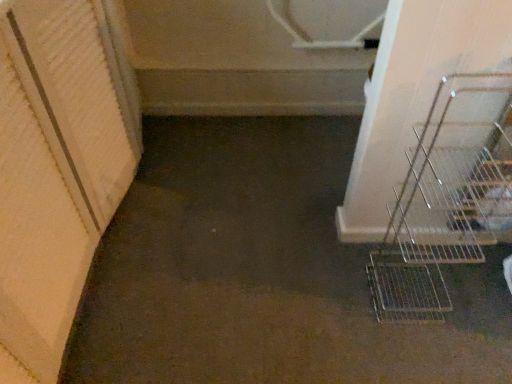
The width and height of the screenshot is (512, 384). Describe the element at coordinates (447, 198) in the screenshot. I see `metal wire rack at right` at that location.

The width and height of the screenshot is (512, 384). I want to click on metal wire rack at right, so click(x=447, y=198).

In order to face metal wire rack at right, should I rotate leftwards or rightwards?

It's best to rotate right around 23.766 degrees.

What are the coordinates of `metal wire rack at right` in the screenshot? It's located at (447, 198).